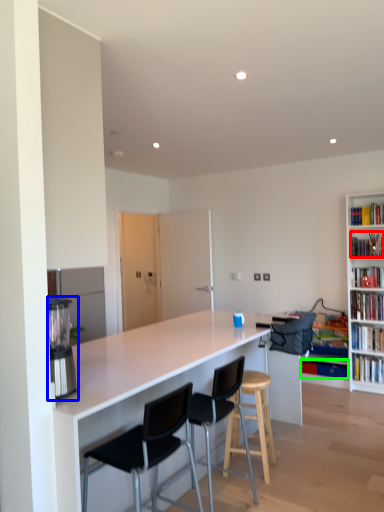
Question: Which object is the closest to the book (highlighted by a red box)? Choose among these: appliance (highlighted by a blue box) or book (highlighted by a green box).

Choices:
 (A) appliance
 (B) book

Answer: (B)